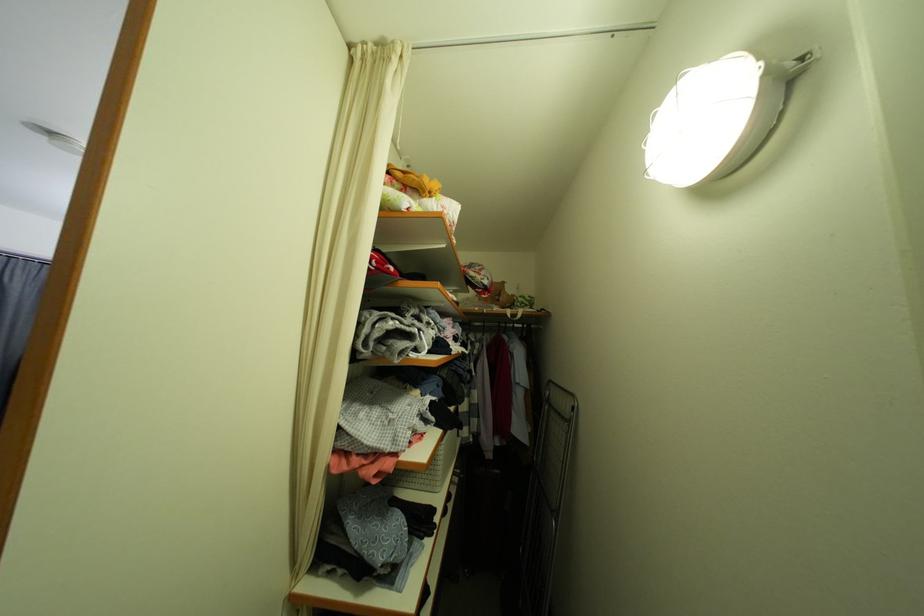
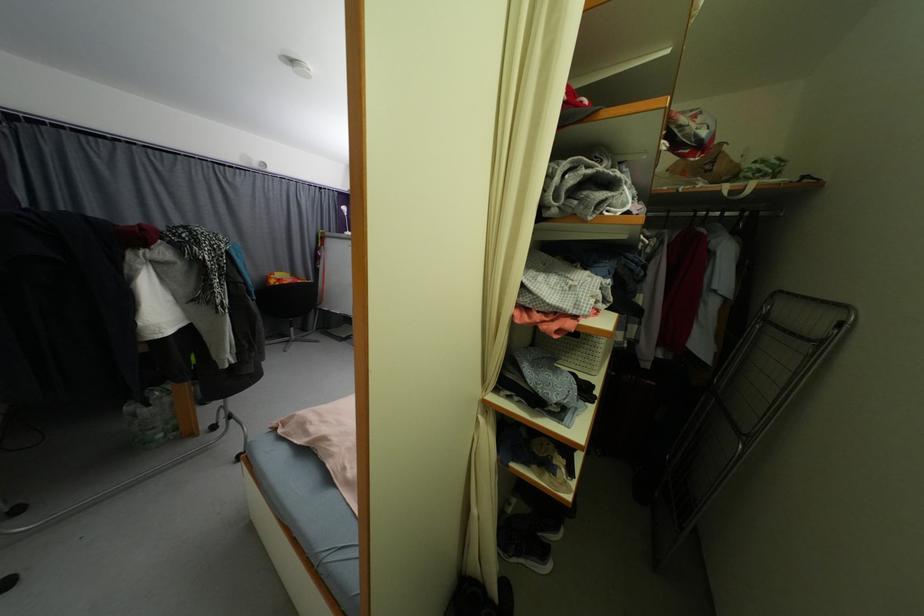
First-person continuous shooting, in which direction is the camera rotating?

The rotation direction of the camera is left-down.